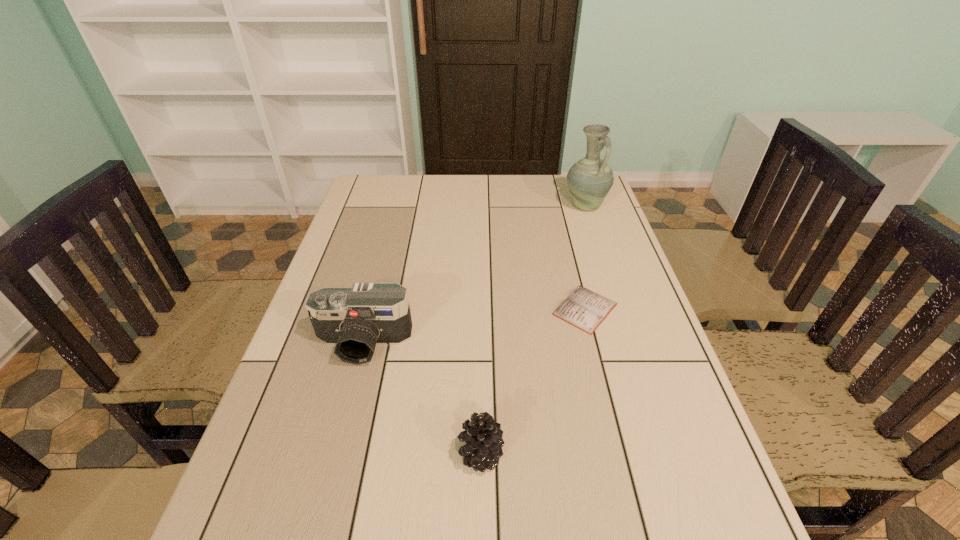
Find the location of a particular element. The image size is (960, 540). the closest object to the leftmost object is located at coordinates (483, 438).

Identify the location of object that is the third closest to the diary. (355, 319).

Locate an element on the screen. The height and width of the screenshot is (540, 960). blank space that satisfies the following two spatial constraints: 1. on the front-facing side of the leftmost object; 2. on the right side of the nearest object is located at coordinates (334, 454).